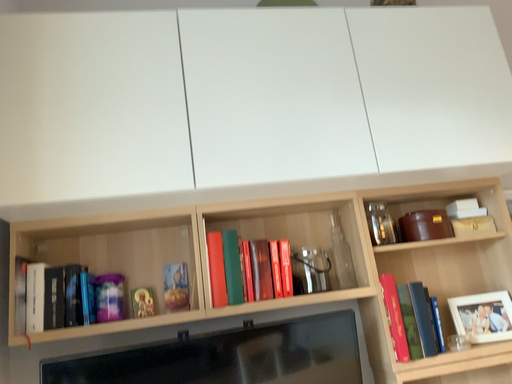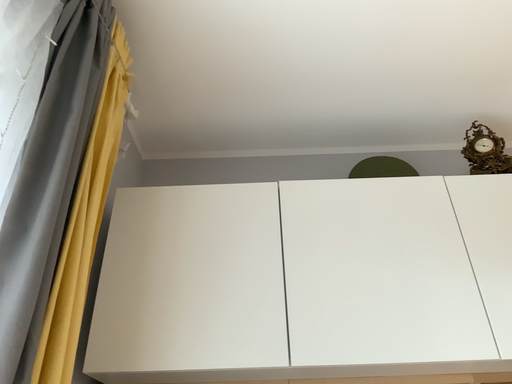
Question: How did the camera likely rotate when shooting the video?

Choices:
 (A) rotated right
 (B) rotated left

Answer: (B)